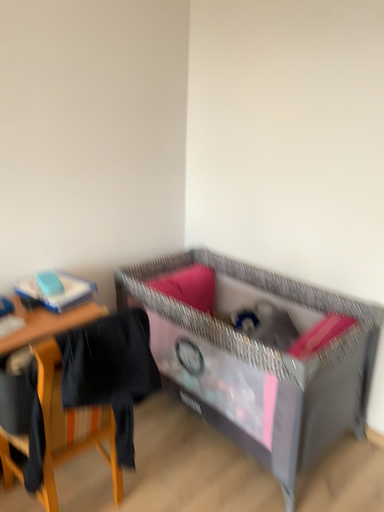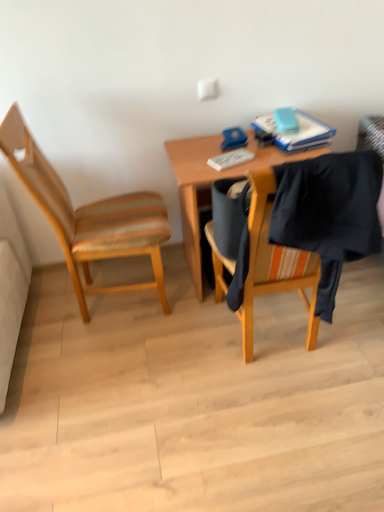
Question: Which way did the camera rotate in the video?

Choices:
 (A) rotated upward
 (B) rotated downward

Answer: (B)